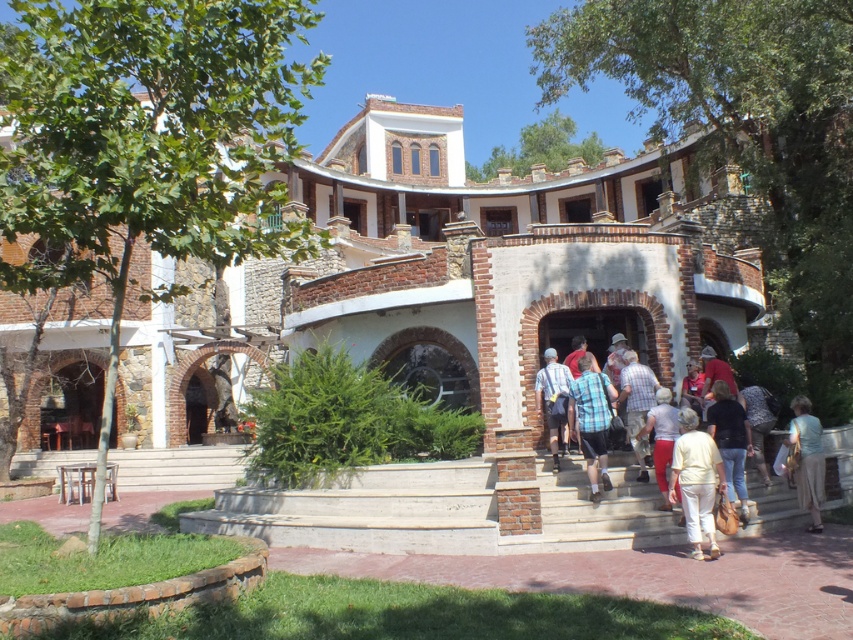
Is point (643, 401) closer to camera compared to point (660, 426)?

No, it is behind (660, 426).

Is plaid shirt at center closer to camera compared to light beige pants at center?

No.

Image resolution: width=853 pixels, height=640 pixels. I want to click on plaid shirt at center, so click(636, 401).

Does light beige pants at lower right have a larger size compared to striped shirt at center?

No.

Looking at this image, does light beige pants at lower right lie behind striped shirt at center?

No.

The width and height of the screenshot is (853, 640). What do you see at coordinates (695, 481) in the screenshot? I see `light beige pants at lower right` at bounding box center [695, 481].

I want to click on light beige pants at lower right, so click(695, 481).

Is point (546, 480) in front of point (682, 429)?

No, it is behind (682, 429).

This screenshot has height=640, width=853. Describe the element at coordinates (602, 509) in the screenshot. I see `light beige cotton shirt at center` at that location.

At what (x,y) coordinates should I click in order to perform the action: click on light beige cotton shirt at center. Please return your answer as a coordinate pair (x, y). Image resolution: width=853 pixels, height=640 pixels. Looking at the image, I should click on (602, 509).